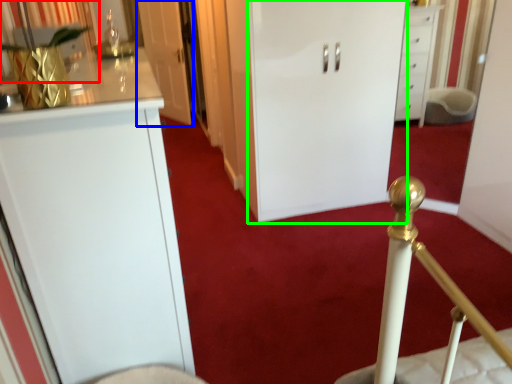
Question: Considering the real-world distances, which object is farthest from curtain (highlighted by a red box)? door (highlighted by a blue box) or door (highlighted by a green box)?

Choices:
 (A) door
 (B) door

Answer: (A)